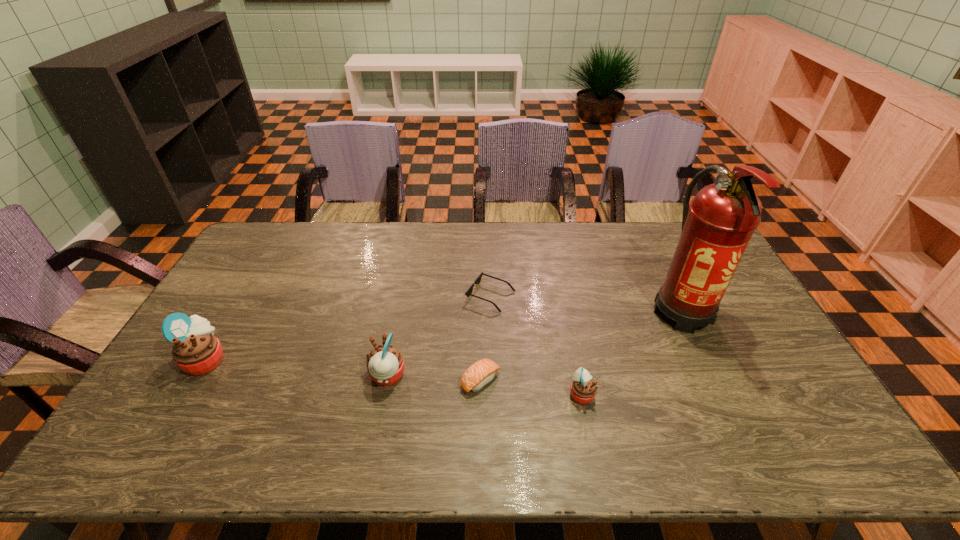
Find the location of a particular element. Image resolution: width=960 pixels, height=540 pixels. free point between the third shortest object and the sunglasses is located at coordinates (536, 345).

Find the location of a particular element. This screenshot has width=960, height=540. vacant space that's between the tallest object and the second muffin from left to right is located at coordinates (535, 343).

I want to click on empty space between the fourth tallest object and the fire extinguisher, so click(x=632, y=352).

Identify the location of empty location between the fire extinguisher and the fifth object from right to left. This screenshot has width=960, height=540. (535, 343).

I want to click on unoccupied area between the rightmost object and the leftmost object, so click(x=444, y=335).

Find the location of a particular element. empty space that is in between the tallest object and the fifth tallest object is located at coordinates (581, 346).

Locate an element on the screen. This screenshot has height=540, width=960. unoccupied position between the fire extinguisher and the fourth shortest object is located at coordinates (535, 343).

This screenshot has height=540, width=960. I want to click on object that stands as the second closest to the shortest object, so click(385, 364).

Where is `object that is the fifth closest to the fifth tallest object`? object that is the fifth closest to the fifth tallest object is located at coordinates (196, 351).

Locate an element on the screen. Image resolution: width=960 pixels, height=540 pixels. muffin that stands as the closest to the leftmost object is located at coordinates (385, 364).